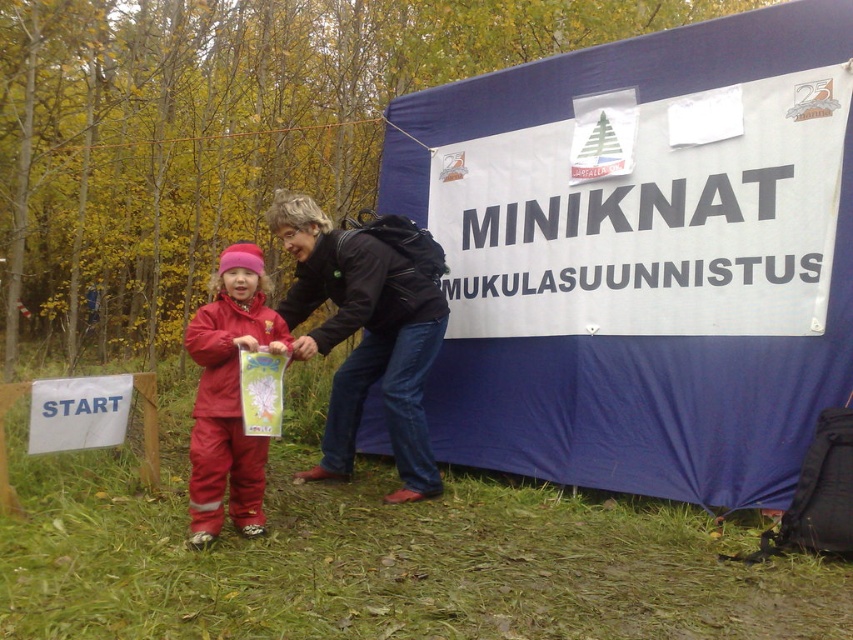
Is black leather jacket at center positioned before matte red snowsuit at center?

No, it is behind matte red snowsuit at center.

What are the coordinates of `black leather jacket at center` in the screenshot? It's located at (364, 336).

The height and width of the screenshot is (640, 853). In order to click on black leather jacket at center in this screenshot , I will do `click(364, 336)`.

Consider the image. Can you confirm if blue fabric tent at center is positioned above black leather jacket at center?

Correct, blue fabric tent at center is located above black leather jacket at center.

Can you confirm if blue fabric tent at center is taller than black leather jacket at center?

Correct, blue fabric tent at center is much taller as black leather jacket at center.

In order to click on blue fabric tent at center in this screenshot , I will do `click(643, 259)`.

Measure the distance between blue fabric tent at center and camera.

blue fabric tent at center is 3.29 meters away from camera.

Which is more to the left, blue fabric tent at center or matte red snowsuit at center?

From the viewer's perspective, matte red snowsuit at center appears more on the left side.

Describe the element at coordinates (643, 259) in the screenshot. The height and width of the screenshot is (640, 853). I see `blue fabric tent at center` at that location.

I want to click on blue fabric tent at center, so click(x=643, y=259).